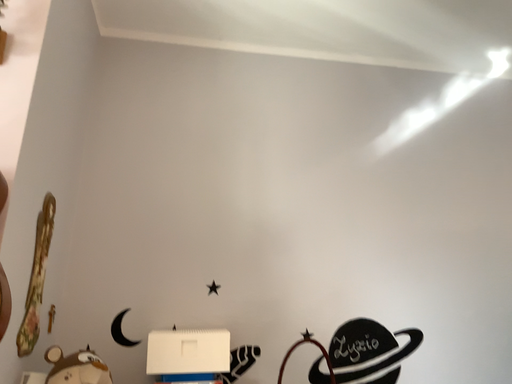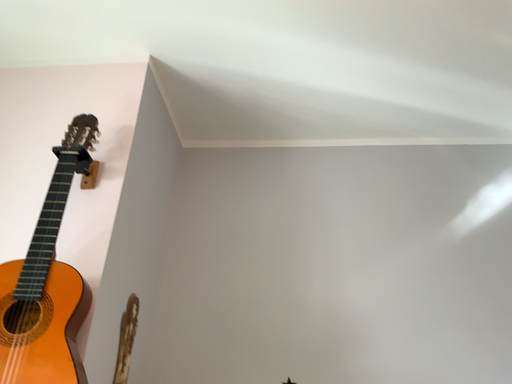
Question: How did the camera likely rotate when shooting the video?

Choices:
 (A) rotated upward
 (B) rotated downward

Answer: (A)